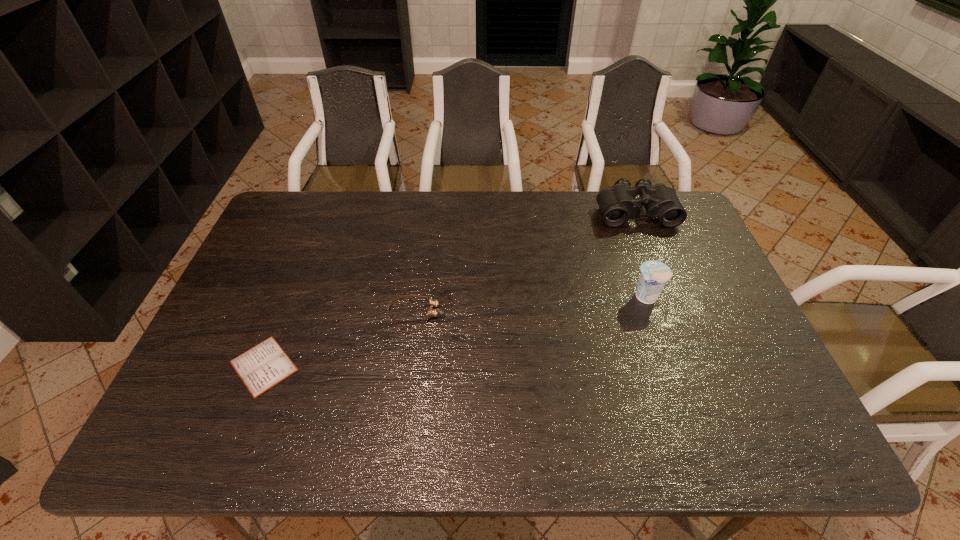
This screenshot has height=540, width=960. I want to click on object present at the far edge, so click(x=617, y=204).

The width and height of the screenshot is (960, 540). Find the location of `object that is at the left edge`. object that is at the left edge is located at coordinates (260, 368).

Find the location of a particular element. object that is at the right edge is located at coordinates (617, 204).

This screenshot has height=540, width=960. What are the coordinates of `object situated at the far right corner` in the screenshot? It's located at (617, 204).

This screenshot has width=960, height=540. I want to click on free spot at the far edge of the desktop, so click(405, 198).

In the image, there is a desktop. Find the location of `vacant space at the near edge`. vacant space at the near edge is located at coordinates (694, 445).

You are a GUI agent. You are given a task and a screenshot of the screen. Output one action in this format:
    pyautogui.click(x=<x>, y=<y>)
    Task: Click on the vacant region at the left edge of the desktop
    The width and height of the screenshot is (960, 540).
    Given the screenshot: What is the action you would take?
    pyautogui.click(x=274, y=314)

At what (x,y) coordinates should I click in order to perform the action: click on vacant area at the right edge of the desktop. Please return your answer as a coordinate pair (x, y). This screenshot has height=540, width=960. Looking at the image, I should click on (697, 290).

The image size is (960, 540). In the image, there is a desktop. Identify the location of blank space at the far left corner. (307, 207).

The width and height of the screenshot is (960, 540). In the image, there is a desktop. Find the location of `vacant region at the far right corner`. vacant region at the far right corner is located at coordinates (655, 227).